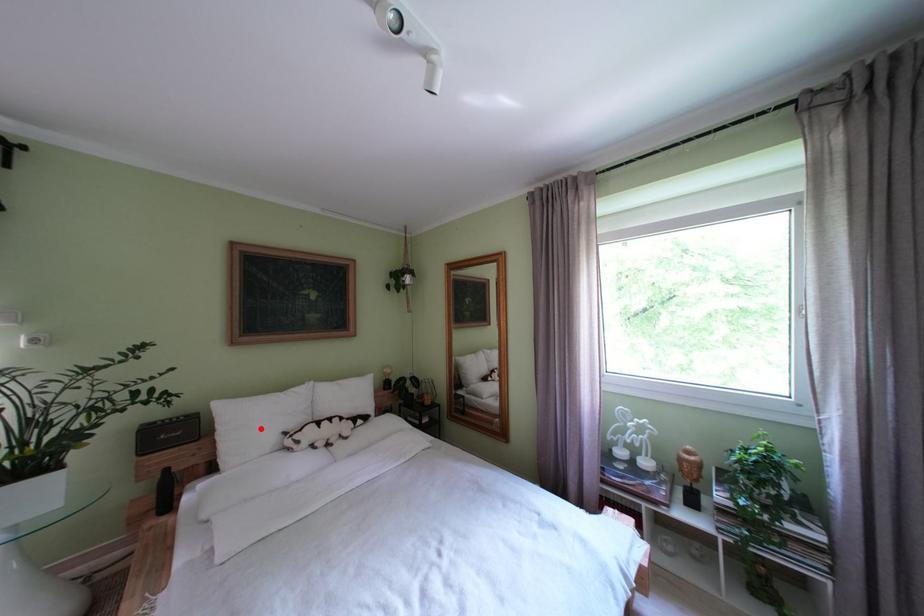
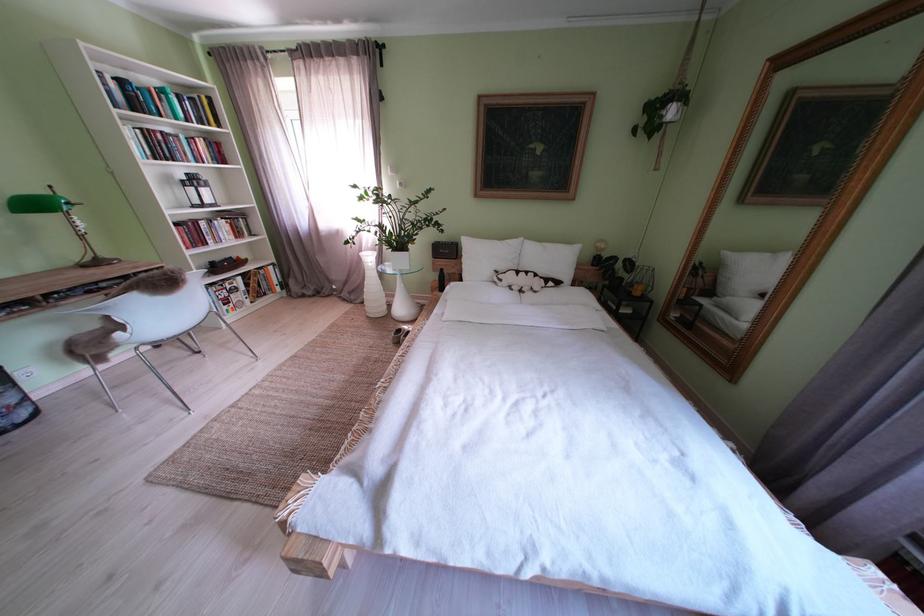
In the second image, find the point that corresponds to the highlighted location in the first image.

(490, 262)